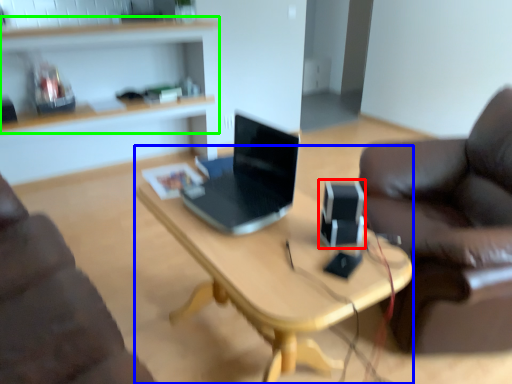
Question: Which object is the closest to the speaker (highlighted by a red box)? Choose among these: desk (highlighted by a blue box) or shelf (highlighted by a green box).

Choices:
 (A) desk
 (B) shelf

Answer: (A)